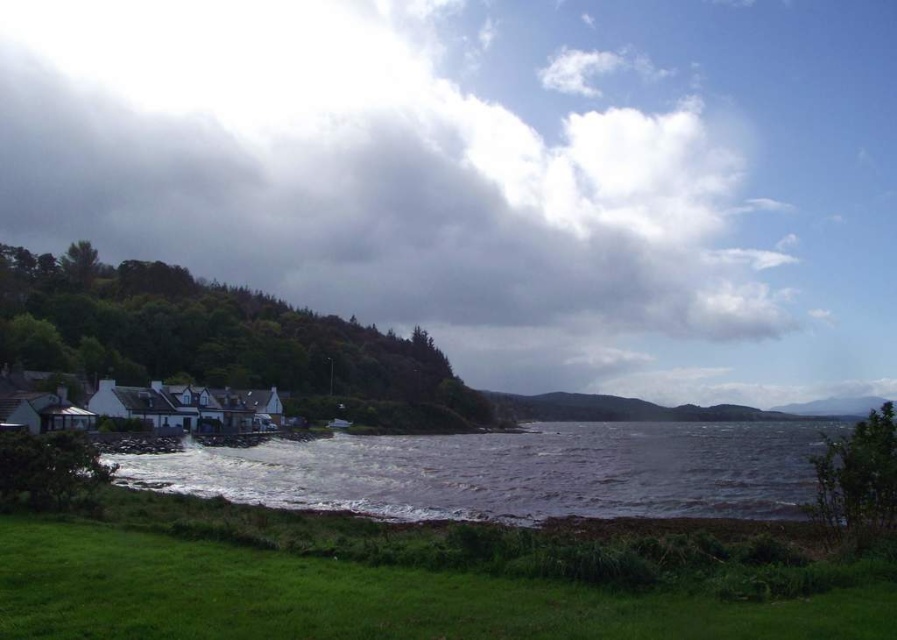
Question: Does cloudy sky at upper center appear on the right side of brown/rough water at lower center?

Choices:
 (A) yes
 (B) no

Answer: (B)

Question: Can you confirm if cloudy sky at upper center is bigger than brown/rough water at lower center?

Choices:
 (A) yes
 (B) no

Answer: (A)

Question: Can you confirm if cloudy sky at upper center is wider than brown/rough water at lower center?

Choices:
 (A) no
 (B) yes

Answer: (B)

Question: Which point appears closest to the camera in this image?

Choices:
 (A) (599, 378)
 (B) (576, 509)

Answer: (B)